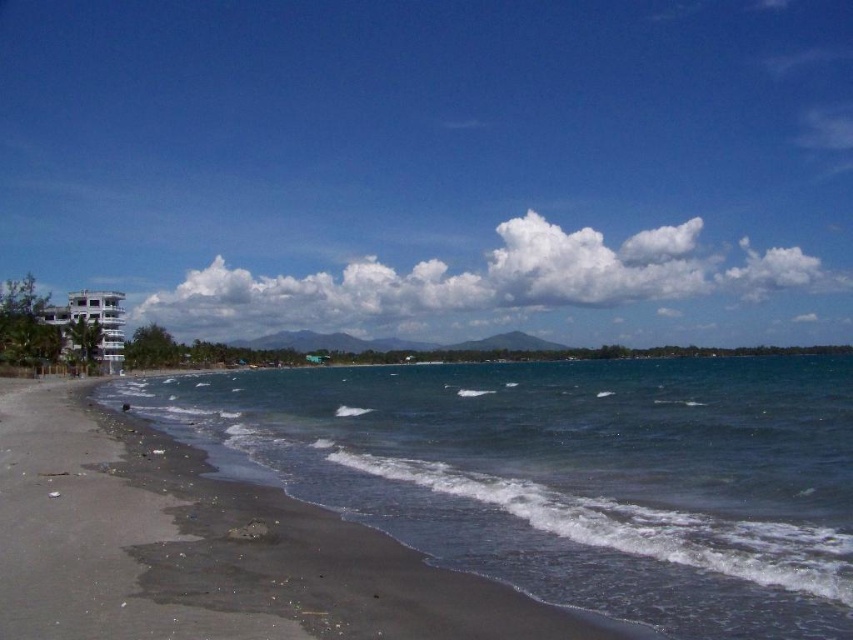
Does dark blue water at lower left lie behind white glossy building at left?

No, dark blue water at lower left is closer to the viewer.

Is point (281, 388) positioned behind point (114, 300)?

No, it is in front of (114, 300).

Identify the location of dark blue water at lower left. (567, 476).

Is dark blue water at lower left to the right of white fluffy cloud at upper center from the viewer's perspective?

In fact, dark blue water at lower left is to the left of white fluffy cloud at upper center.

Looking at this image, which is more to the right, dark blue water at lower left or white fluffy cloud at upper center?

white fluffy cloud at upper center

Between point (241, 444) and point (698, 250), which one is positioned behind?

Positioned behind is point (698, 250).

Identify the location of dark blue water at lower left. (567, 476).

Does white fluffy cloud at upper center have a smaller size compared to white glossy building at left?

Actually, white fluffy cloud at upper center might be larger than white glossy building at left.

Is point (173, 326) positioned after point (67, 314)?

Yes, it is behind point (67, 314).

Between point (537, 262) and point (105, 291), which one is positioned behind?

Point (537, 262)

Where is `white fluffy cloud at upper center`? The image size is (853, 640). white fluffy cloud at upper center is located at coordinates (525, 292).